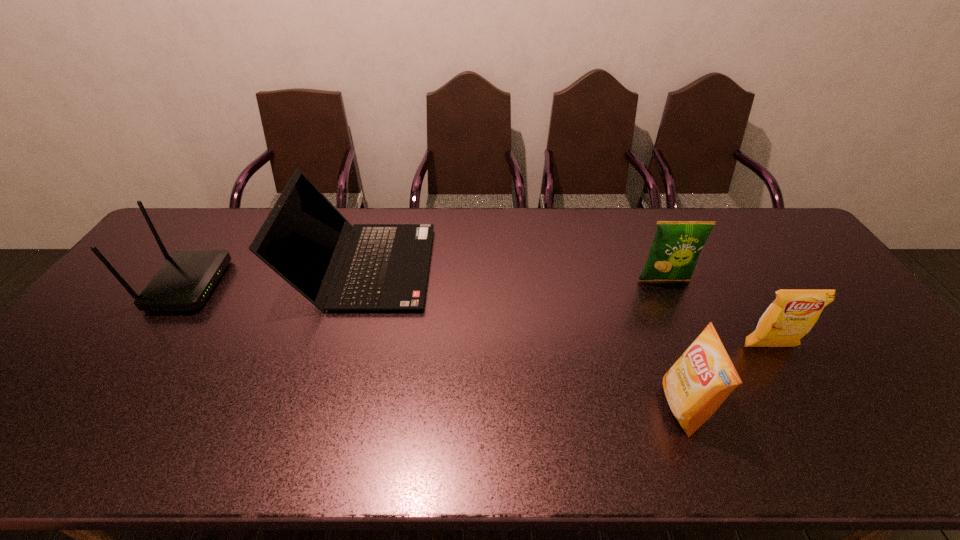
Find the location of a particular element. The width and height of the screenshot is (960, 540). the second closest object to the farthest crisp (potato chip) is located at coordinates (703, 377).

Where is `crisp (potato chip) that is the second closest to the nearest crisp (potato chip)`? crisp (potato chip) that is the second closest to the nearest crisp (potato chip) is located at coordinates (676, 247).

Locate which crisp (potato chip) ranks in proximity to the second farthest crisp (potato chip). Please provide its 2D coordinates. Your answer should be formatted as a tuple, i.e. [(x, y)], where the tuple contains the x and y coordinates of a point satisfying the conditions above.

[(703, 377)]

At what (x,y) coordinates should I click in order to perform the action: click on vacant space that satisfies the following two spatial constraints: 1. on the front of the second nearest crisp (potato chip) with the logo; 2. on the front-facing side of the nearest object. Please return your answer as a coordinate pair (x, y). Looking at the image, I should click on (804, 407).

Where is `free point that satisfies the following two spatial constraints: 1. on the front-facing side of the farthest crisp (potato chip); 2. on the front-facing side of the leftmost object`? This screenshot has height=540, width=960. free point that satisfies the following two spatial constraints: 1. on the front-facing side of the farthest crisp (potato chip); 2. on the front-facing side of the leftmost object is located at coordinates (666, 285).

Find the location of a particular element. This screenshot has height=540, width=960. free space that satisfies the following two spatial constraints: 1. on the front of the rightmost crisp (potato chip) with the logo; 2. on the front-facing side of the nearest crisp (potato chip) is located at coordinates (804, 407).